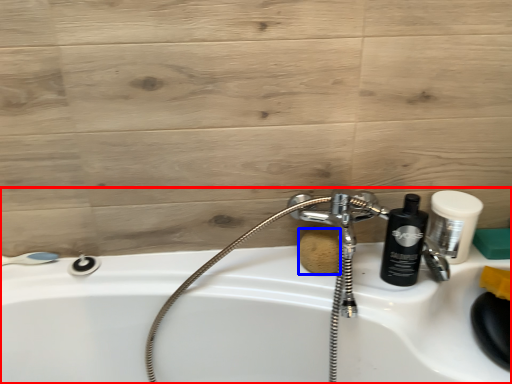
Question: Which object appears closest to the camera in this image, sink (highlighted by a red box) or soap (highlighted by a blue box)?

Choices:
 (A) sink
 (B) soap

Answer: (A)